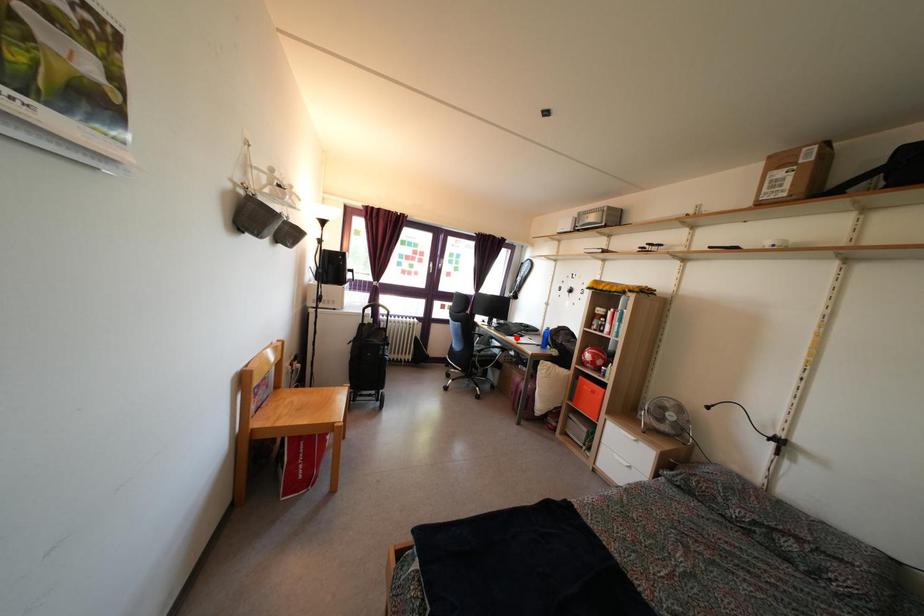
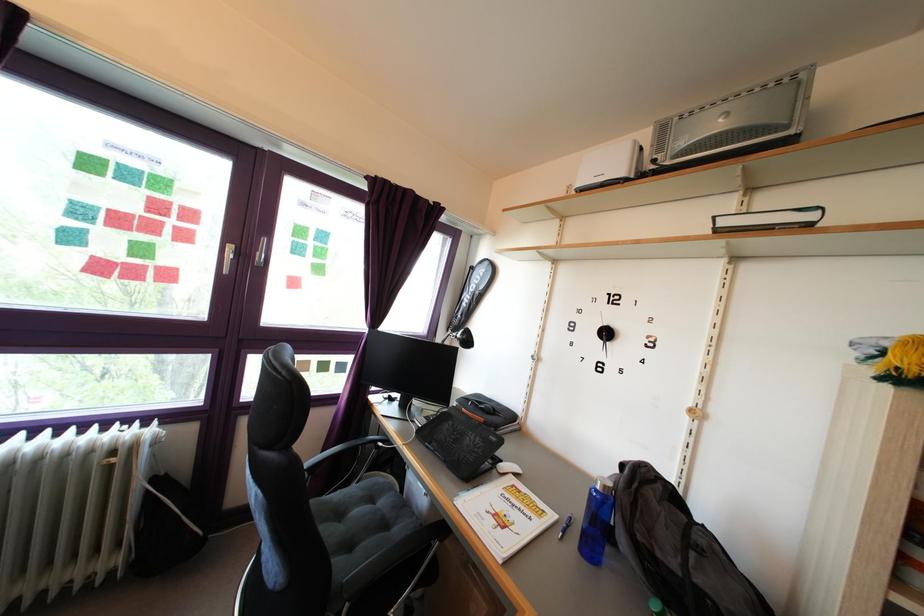
Locate, in the second image, the point that corresponds to the highlighted location in the first image.

(472, 447)